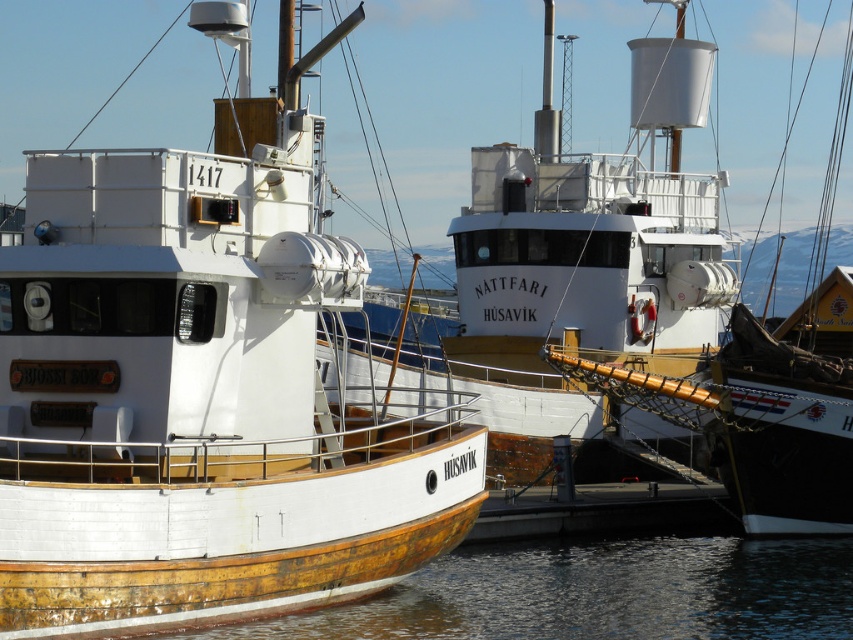
Looking at this image, you are a dock worker who needs to ensure both boats can fit side by side in a new docking area. The docking area has a width limit of 10 meters. If the wooden ship at center requires 8 meters of width, will the white matte boat at center also fit within the remaining space?

The white matte boat at center has a lesser width compared to wooden ship at center. Since the wooden ship at center requires 8 meters, the white matte boat at center would need less than 8 meters. If the total docking area is 10 meters, subtracting the 8 meters for the wooden ship leaves 2 meters. However, since the white matte boat requires less than 8 meters, it would easily fit within the remaining space. Therefore, both boats can fit side by side within the 10 meter limit.

You are a sailor trying to locate a specific point on the wooden hull boat at center. The coordinates given are point (198, 397). Where exactly would this point be located on the wooden hull boat at center?

The point (198, 397) is located on the wooden hull boat at center, which is the boat on the left with the orange sign reading Bjossi Bjorn and the number 1417 displayed on its side. The coordinates would place it somewhere along the wooden hull area of the boat.

You are a photographer standing at the edge of the harbor, wanting to capture both the white matte boat at center and the wooden ship at center in your shot. Which boat should you focus on first to ensure it appears larger in the photo?

You should focus on the white matte boat at center first because it is closer to the viewer, making it appear larger in the photo compared to the wooden ship at center which is farther away.